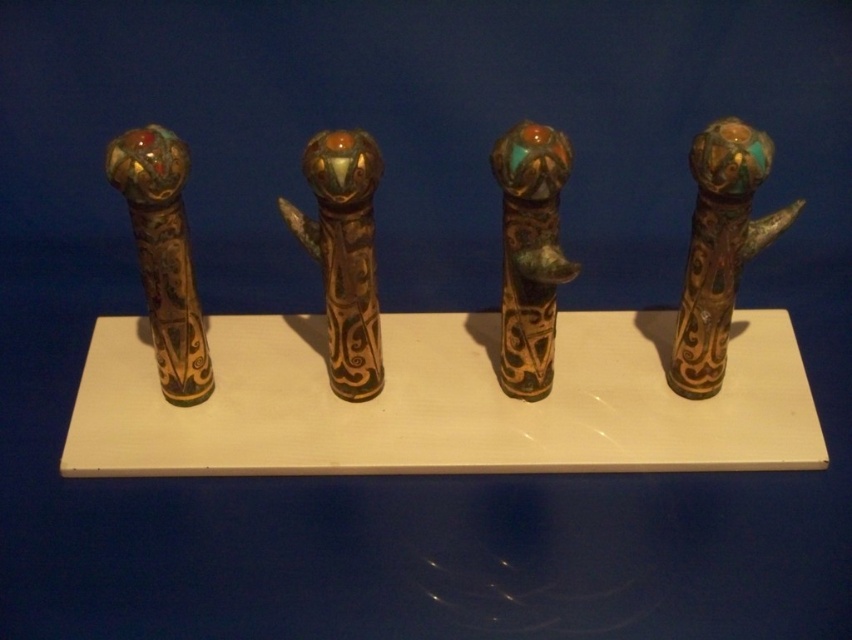
You are an art conservator standing 1.5 meters away from the glossy bronze staff at center. Can you reach it without moving closer?

The glossy bronze staff at center is 1.07 meters from the viewer. Since you are standing 1.5 meters away, you are too far to reach it without moving closer.

You are standing 1 meter away from the platform where the four ornate cylindrical objects are displayed. If you move forward 0.5 meters, will the point at coordinates point (528, 250) become closer to you?

The point at coordinates point (528, 250) is currently 1.15 meters away from you. If you move forward 0.5 meters, your new distance to the point would be 0.65 meters, which is closer. Therefore, yes, the point will become closer to you after moving forward.